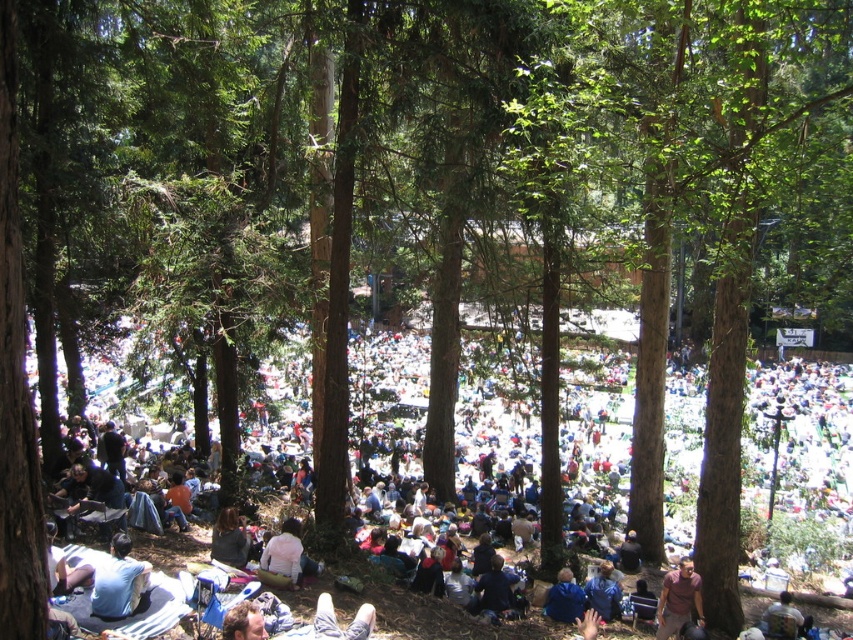
Is point (769, 474) closer to viewer compared to point (265, 572)?

No, it is behind (265, 572).

Does point (457, 472) come closer to viewer compared to point (267, 557)?

No, it is not.

Find the location of a particular element. The image size is (853, 640). light blue fabric at lower left is located at coordinates (801, 467).

Can you confirm if light blue fabric at lower left is bigger than dark gray sweater at lower center?

Correct, light blue fabric at lower left is larger in size than dark gray sweater at lower center.

Is the position of light blue fabric at lower left less distant than that of dark gray sweater at lower center?

That is False.

The width and height of the screenshot is (853, 640). What are the coordinates of `light blue fabric at lower left` in the screenshot? It's located at (801, 467).

Does blue denim jeans at lower center have a larger size compared to light brown leather jacket at lower right?

No.

Is blue denim jeans at lower center closer to camera compared to light brown leather jacket at lower right?

Yes, blue denim jeans at lower center is closer to the viewer.

The image size is (853, 640). What do you see at coordinates (335, 621) in the screenshot?
I see `blue denim jeans at lower center` at bounding box center [335, 621].

You are a GUI agent. You are given a task and a screenshot of the screen. Output one action in this format:
    pyautogui.click(x=<x>, y=<y>)
    Task: Click on the blue denim jeans at lower center
    The height and width of the screenshot is (640, 853).
    Given the screenshot: What is the action you would take?
    pyautogui.click(x=335, y=621)